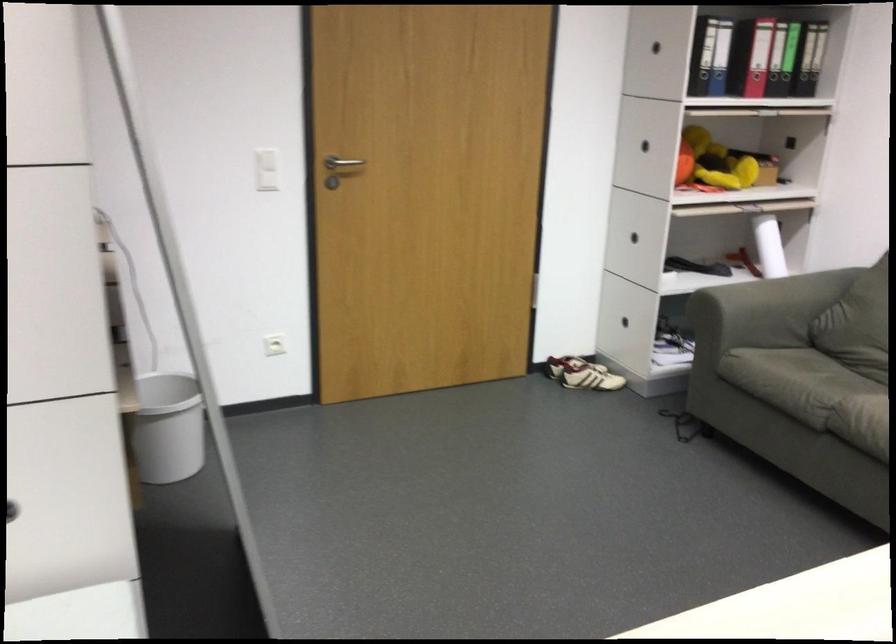
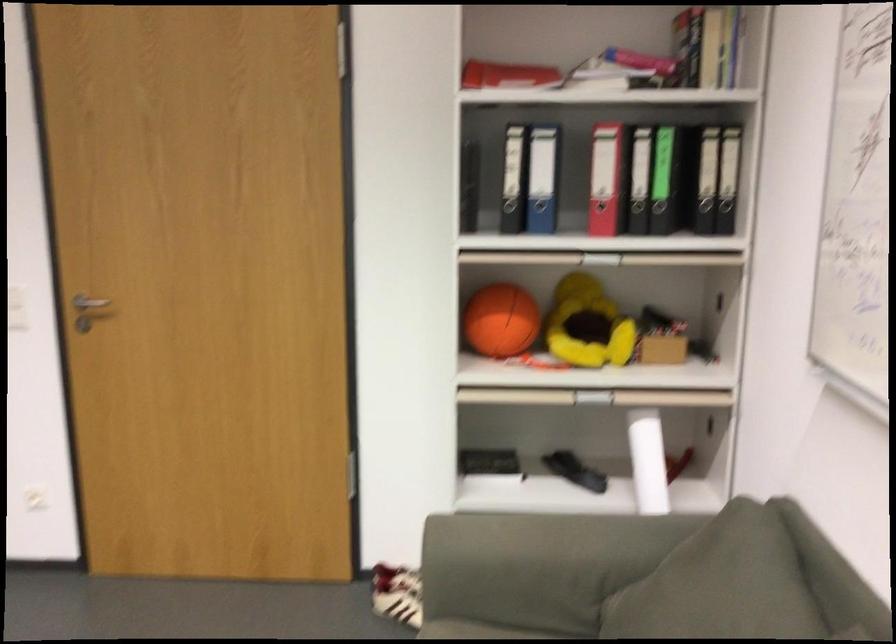
Find the pixel in the second image that matches (x=773, y=242) in the first image.

(648, 460)